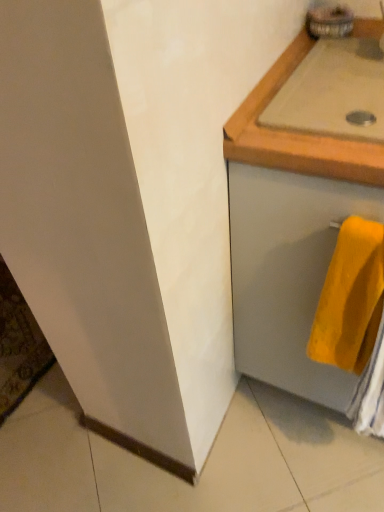
Question: In terms of width, does yellow soft towel at lower right look wider or thinner when compared to matte gray drawer at right?

Choices:
 (A) thin
 (B) wide

Answer: (A)

Question: Relative to matte gray drawer at right, is yellow soft towel at lower right in front or behind?

Choices:
 (A) behind
 (B) front

Answer: (A)

Question: Which object is positioned farthest from the yellow soft towel at lower right?

Choices:
 (A) matte gray drawer at right
 (B) beige wood countertop at upper right

Answer: (B)

Question: Estimate the real-world distances between objects in this image. Which object is closer to the yellow soft towel at lower right?

Choices:
 (A) beige wood countertop at upper right
 (B) matte gray drawer at right

Answer: (B)